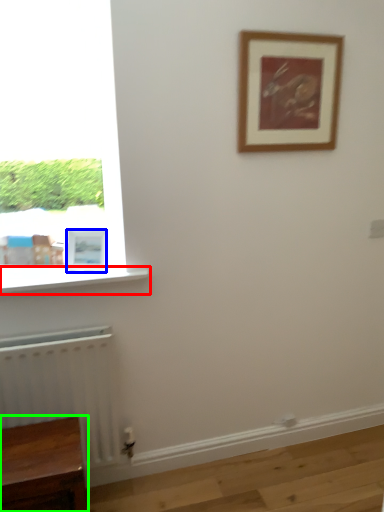
Question: Which object is the farthest from window sill (highlighted by a red box)? Choose among these: picture frame (highlighted by a blue box) or furniture (highlighted by a green box).

Choices:
 (A) picture frame
 (B) furniture

Answer: (B)